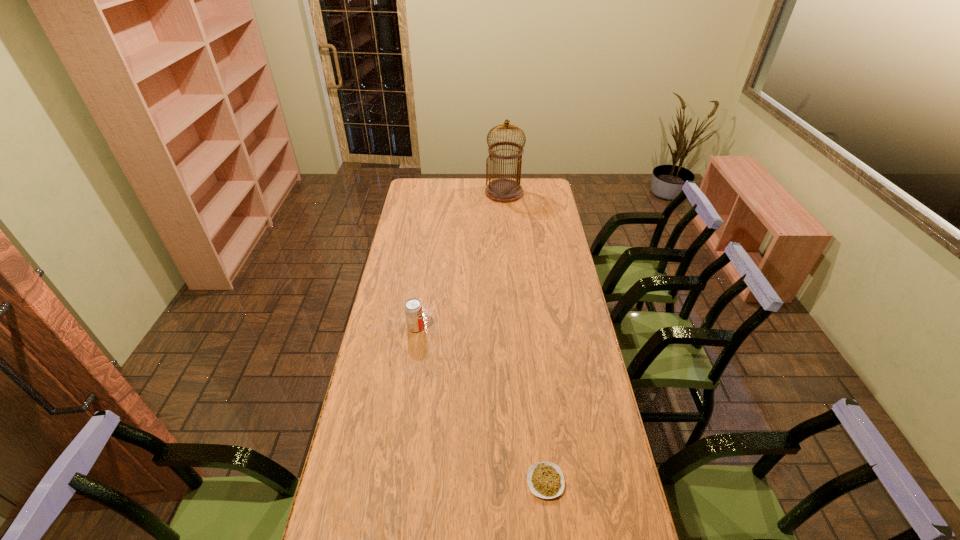
Locate an element on the screen. The image size is (960, 540). object located in the left edge section of the desktop is located at coordinates (413, 308).

In the image, there is a desktop. Where is `vacant space at the left edge`? vacant space at the left edge is located at coordinates (384, 431).

Where is `vacant space at the right edge of the desktop`? This screenshot has height=540, width=960. vacant space at the right edge of the desktop is located at coordinates point(580,334).

Find the location of a particular element. free location at the far left corner is located at coordinates (407, 195).

In the image, there is a desktop. Where is `free space at the far right corner`? The height and width of the screenshot is (540, 960). free space at the far right corner is located at coordinates (549, 192).

The height and width of the screenshot is (540, 960). In order to click on vacant space in between the soda and the legume in this screenshot , I will do `click(481, 404)`.

Identify the location of unoccupied position between the soda and the shortest object. (481, 404).

This screenshot has height=540, width=960. I want to click on free space between the birdcage and the second nearest object, so click(x=460, y=260).

This screenshot has width=960, height=540. Identify the location of vacant point located between the tallest object and the second shortest object. (460, 260).

The image size is (960, 540). What are the coordinates of `empty location between the second shortest object and the tallest object` in the screenshot? It's located at (460, 260).